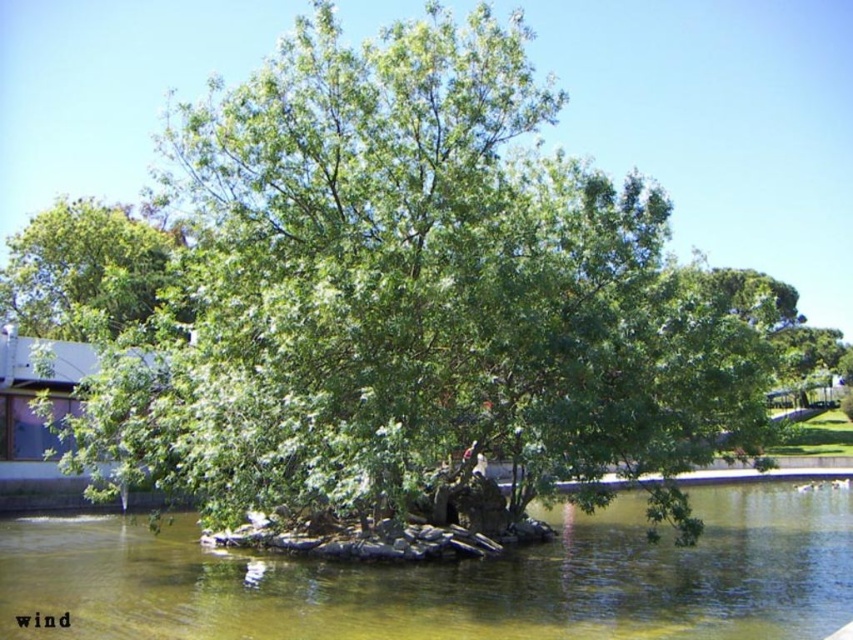
Question: Among these points, which one is farthest from the camera?

Choices:
 (A) (55, 282)
 (B) (171, 584)

Answer: (A)

Question: Is greenish-brown water at center bigger than green leafy tree at upper left?

Choices:
 (A) yes
 (B) no

Answer: (B)

Question: Which of the following is the closest to the observer?

Choices:
 (A) greenish-brown water at center
 (B) green leafy tree at upper left

Answer: (A)

Question: Does greenish-brown water at center appear on the left side of green leafy tree at upper left?

Choices:
 (A) no
 (B) yes

Answer: (A)

Question: Does greenish-brown water at center have a larger size compared to green leafy tree at upper left?

Choices:
 (A) no
 (B) yes

Answer: (A)